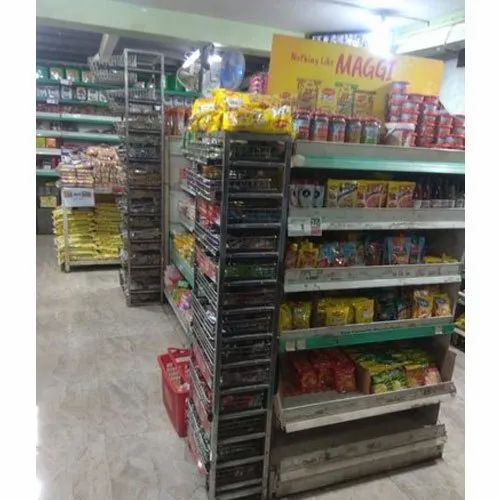
Identify the location of wire rack. (237, 323), (145, 188).